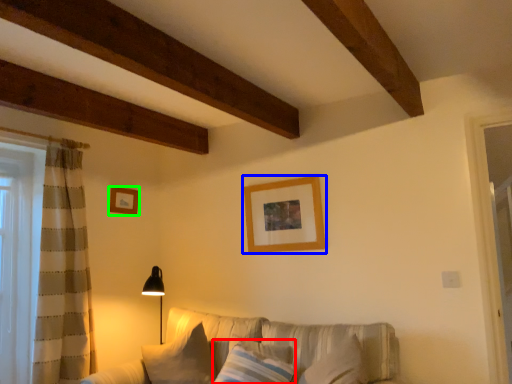
Question: Based on their relative distances, which object is nearer to pillow (highlighted by a red box)? Choose from picture frame (highlighted by a blue box) and picture frame (highlighted by a green box).

Choices:
 (A) picture frame
 (B) picture frame

Answer: (A)